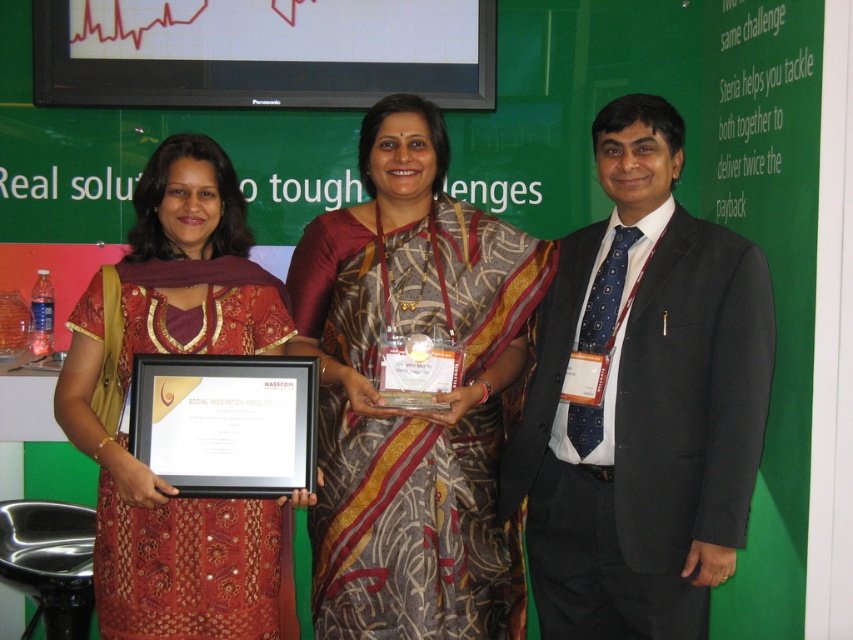
In the scene described, there are two individuals wearing a printed silk saree at center and a matte red dress at center. Which of these two outfits is larger in size?

The printed silk saree at center is smaller than the matte red dress at center, so the matte red dress at center is larger.